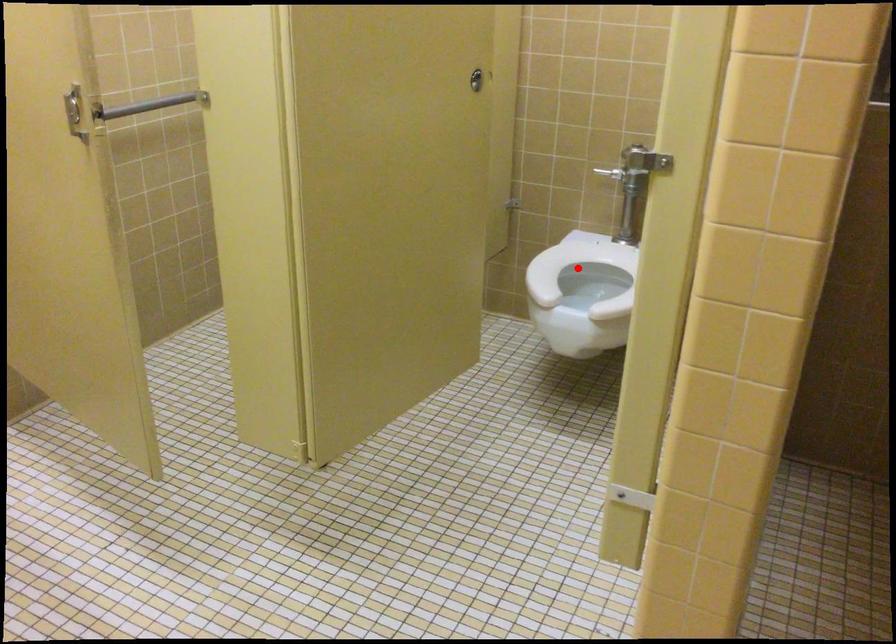
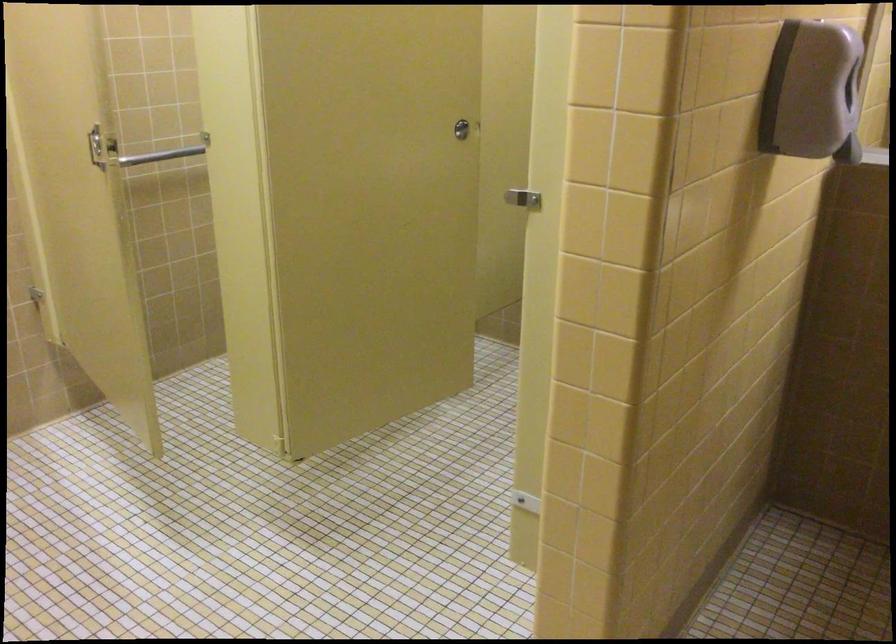
Question: I am providing you with two images of the same scene from different viewpoints. A red point is marked on the first image. Is the red point's position out of view in image 2?

Choices:
 (A) Yes
 (B) No

Answer: (A)